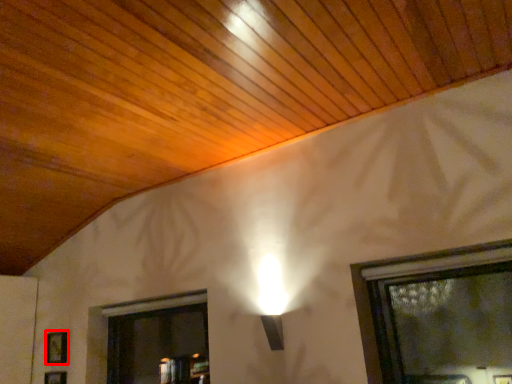
Question: From the image's perspective, considering the relative positions of picture frame (annotated by the red box) and picture frame in the image provided, where is picture frame (annotated by the red box) located with respect to the staircase?

Choices:
 (A) above
 (B) below

Answer: (A)